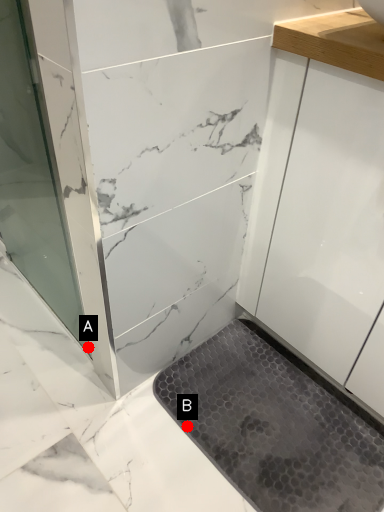
Question: Two points are circled on the image, labeled by A and B beside each circle. Among these points, which one is farthest from the camera?

Choices:
 (A) A is further
 (B) B is further

Answer: (A)